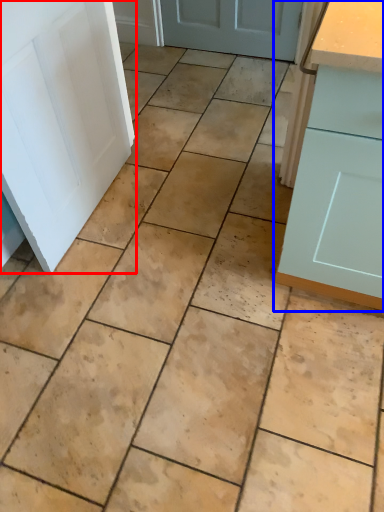
Question: Among these objects, which one is farthest to the camera, door (highlighted by a red box) or cabinetry (highlighted by a blue box)?

Choices:
 (A) door
 (B) cabinetry

Answer: (A)